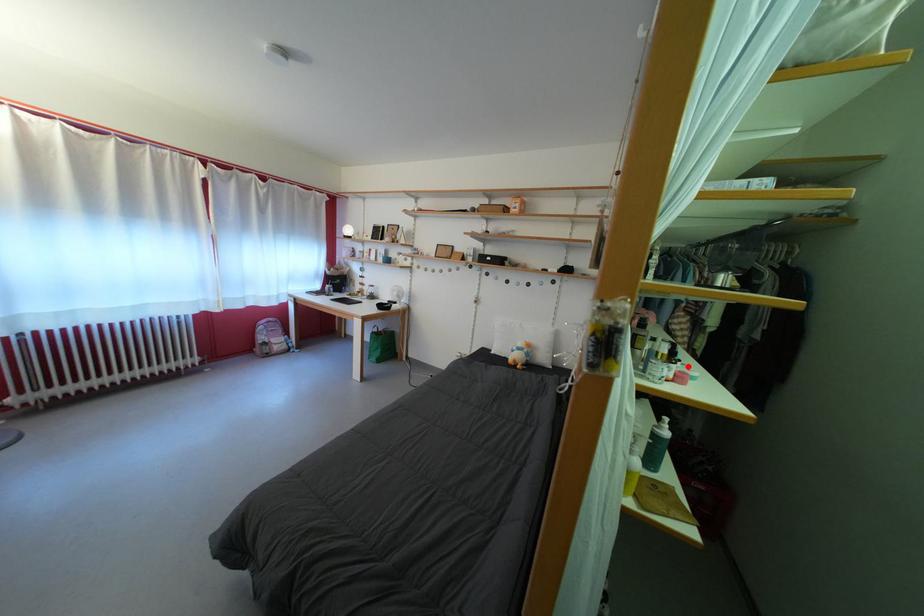
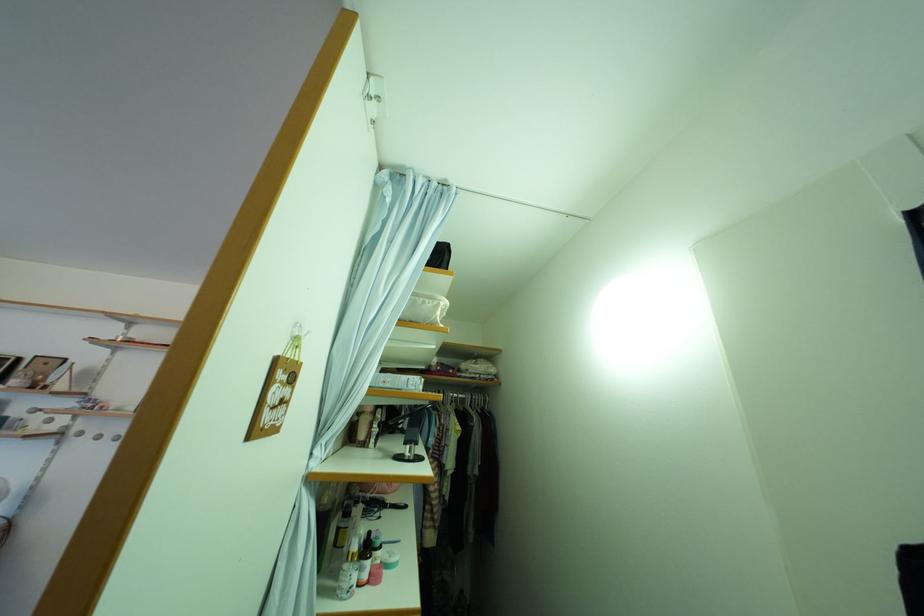
Question: I am providing you with two images of the same scene from different viewpoints. A red point is marked on the first image. Can you still see the location of the red point in image 2?

Choices:
 (A) Yes
 (B) No

Answer: (A)